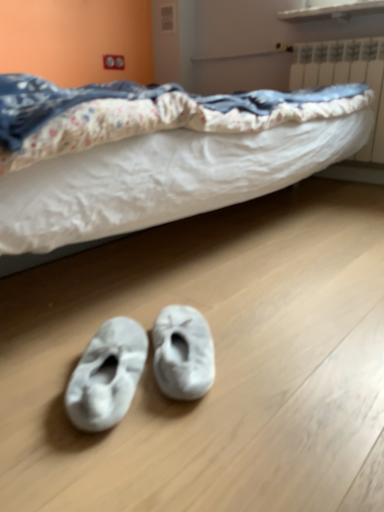
Find the location of a particular element. This screenshot has height=512, width=384. free location to the right of white fuzzy slippers at lower center, the 1th footwear positioned from the left is located at coordinates (228, 392).